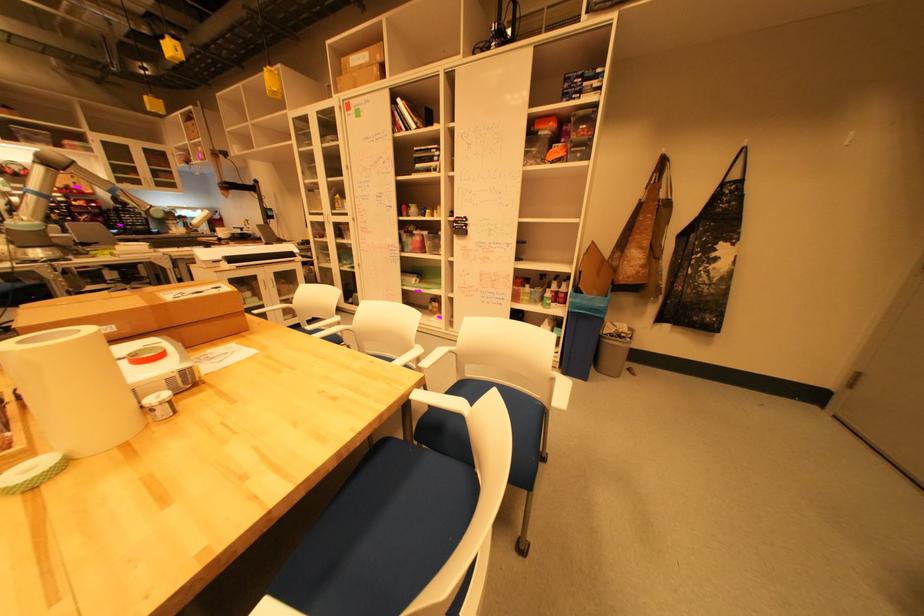
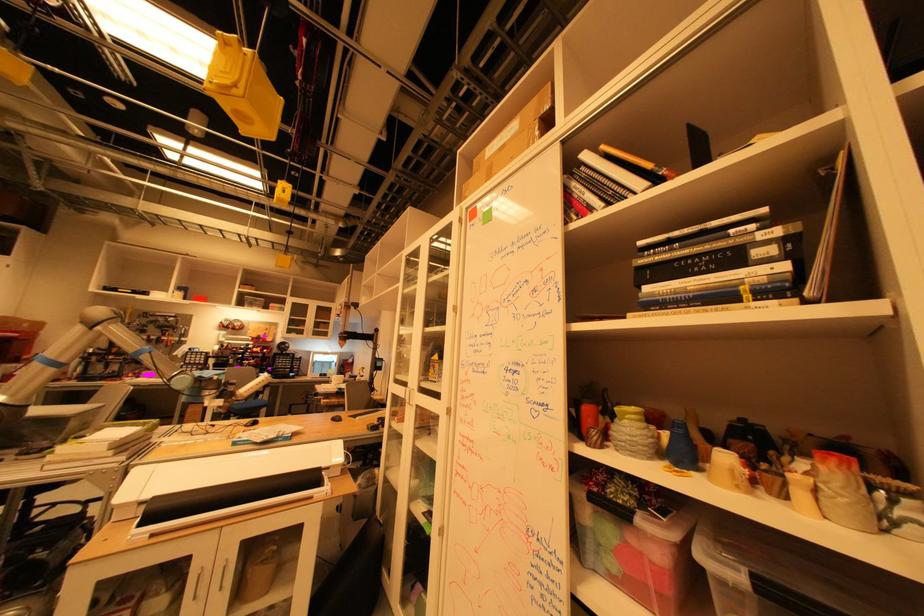
In the second image, find the point that corresponds to [219,262] in the first image.

(138, 505)